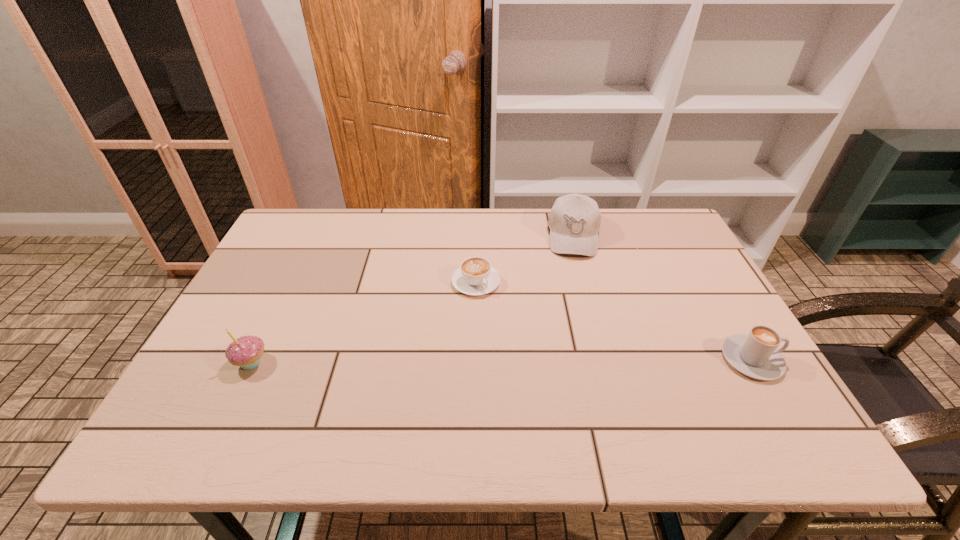
Find the location of `object that is at the near right corner`. object that is at the near right corner is located at coordinates coord(755,355).

I want to click on vacant area at the far edge, so click(x=382, y=215).

In the image, there is a desktop. Identify the location of blank space at the near edge. (273, 375).

In the image, there is a desktop. Identify the location of free space at the left edge. Image resolution: width=960 pixels, height=540 pixels. (265, 335).

At what (x,y) coordinates should I click in order to perform the action: click on vacant space at the right edge. Please return your answer as a coordinate pair (x, y). The height and width of the screenshot is (540, 960). Looking at the image, I should click on (727, 330).

In the image, there is a desktop. At what (x,y) coordinates should I click in order to perform the action: click on vacant space at the far left corner. Please return your answer as a coordinate pair (x, y). Looking at the image, I should click on (334, 211).

Where is `free area in between the farther cappuccino and the taller cappuccino`? free area in between the farther cappuccino and the taller cappuccino is located at coordinates (613, 321).

At what (x,y) coordinates should I click in order to perform the action: click on free space between the leftmost object and the right cappuccino. Please return your answer as a coordinate pair (x, y). The image size is (960, 540). Looking at the image, I should click on (501, 361).

Find the location of `unoccupied position between the cupcake and the farthest object`. unoccupied position between the cupcake and the farthest object is located at coordinates (413, 299).

Where is `unoccupied area between the left cappuccino and the baseball cap`? This screenshot has height=540, width=960. unoccupied area between the left cappuccino and the baseball cap is located at coordinates (525, 259).